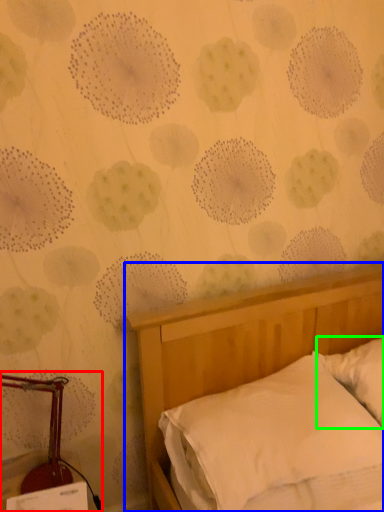
Question: Based on their relative distances, which object is nearer to bedside lamp (highlighted by a red box)? Choose from bed (highlighted by a blue box) and pillow (highlighted by a green box).

Choices:
 (A) bed
 (B) pillow

Answer: (A)